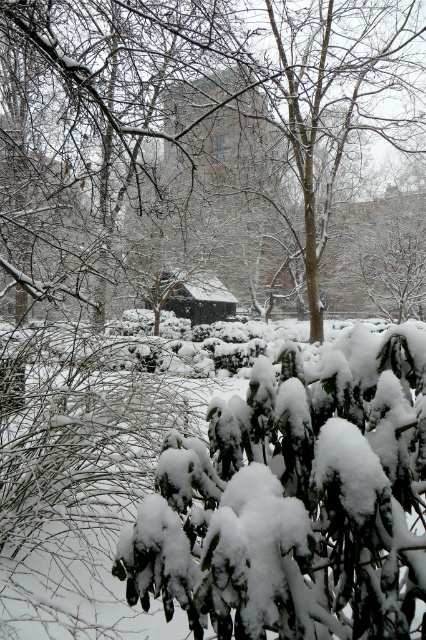
Is snow-covered tree at center positioned behind dark brown wooden hut at center?

That is False.

Is point (284, 195) positioned after point (178, 289)?

No, it is in front of (178, 289).

Which is behind, point (166, 150) or point (206, 300)?

The point (206, 300) is more distant.

Locate an element on the screen. snow-covered tree at center is located at coordinates (195, 138).

Consider the image. Between snow-covered tree at center and white fluffy bush at center, which one has more height?

snow-covered tree at center

Which is more to the right, snow-covered tree at center or white fluffy bush at center?

snow-covered tree at center

Where is `snow-covered tree at center`? The width and height of the screenshot is (426, 640). snow-covered tree at center is located at coordinates (195, 138).

Image resolution: width=426 pixels, height=640 pixels. What are the coordinates of `snow-covered tree at center` in the screenshot? It's located at (195, 138).

This screenshot has width=426, height=640. What do you see at coordinates (294, 500) in the screenshot? I see `white fluffy bush at center` at bounding box center [294, 500].

Which of these two, white fluffy bush at center or dark brown wooden hut at center, stands taller?

With more height is dark brown wooden hut at center.

Where is `white fluffy bush at center`? The width and height of the screenshot is (426, 640). white fluffy bush at center is located at coordinates (294, 500).